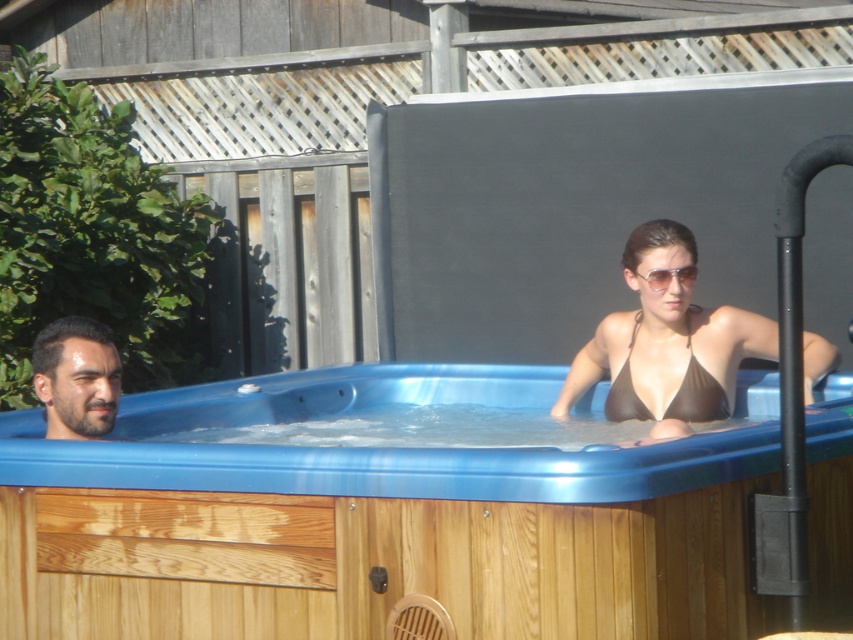
Question: Considering the real-world distances, which object is closest to the brown matte bikini at upper right?

Choices:
 (A) blue plastic hot tub at center
 (B) dark brown hair at left
 (C) sunglasses at upper center

Answer: (C)

Question: Can you confirm if dark brown hair at left is wider than brown matte bikini top at center?

Choices:
 (A) no
 (B) yes

Answer: (A)

Question: Which object is positioned closest to the brown matte bikini top at center?

Choices:
 (A) sunglasses at upper center
 (B) dark brown hair at left

Answer: (A)

Question: Is dark brown hair at left to the right of brown matte bikini top at center from the viewer's perspective?

Choices:
 (A) yes
 (B) no

Answer: (B)

Question: Which of the following is the closest to the observer?

Choices:
 (A) (70, 376)
 (B) (664, 273)
 (C) (825, 476)
 (D) (688, 333)

Answer: (C)

Question: Does blue plastic hot tub at center appear under dark brown hair at left?

Choices:
 (A) no
 (B) yes

Answer: (B)